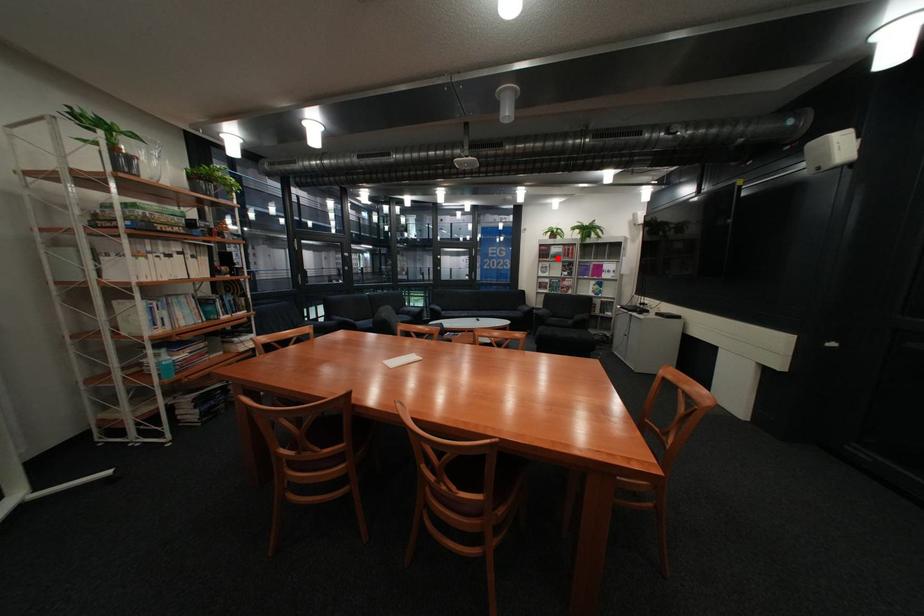
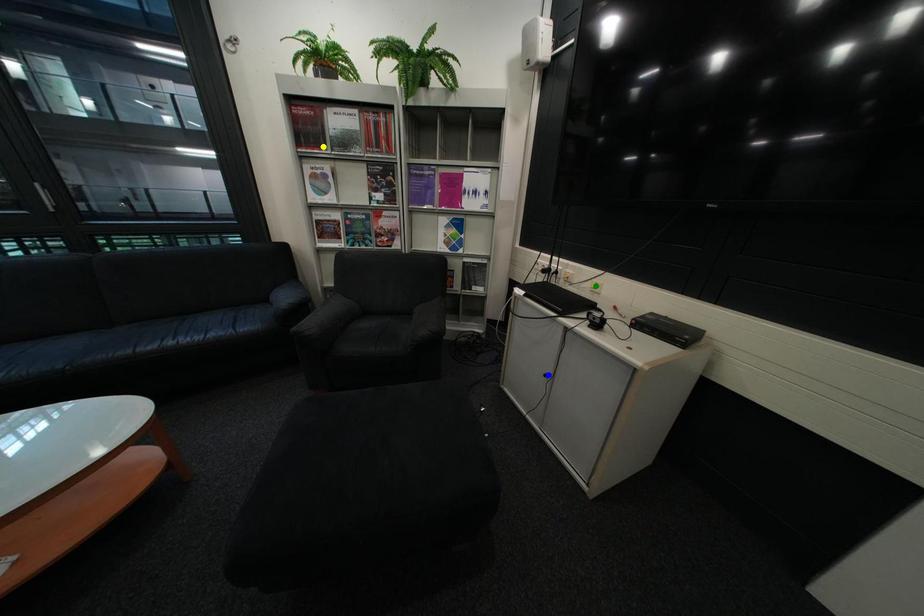
Question: I am providing you with two images of the same scene from different viewpoints. A red point is marked on the first image. You are given multiple points on the second image. Can you choose the point in image 2 that corresponds to the point in image 1?

Choices:
 (A) yellow point
 (B) green point
 (C) blue point

Answer: (A)